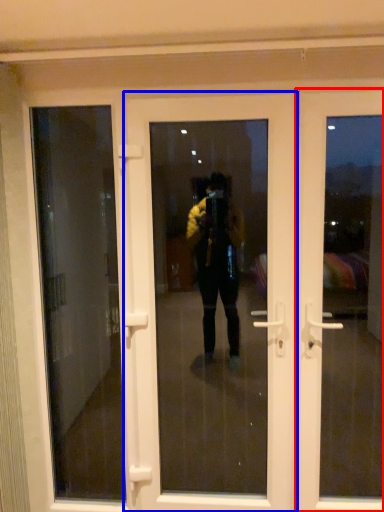
Question: Which point is further to the camera, door (highlighted by a red box) or door (highlighted by a blue box)?

Choices:
 (A) door
 (B) door

Answer: (B)